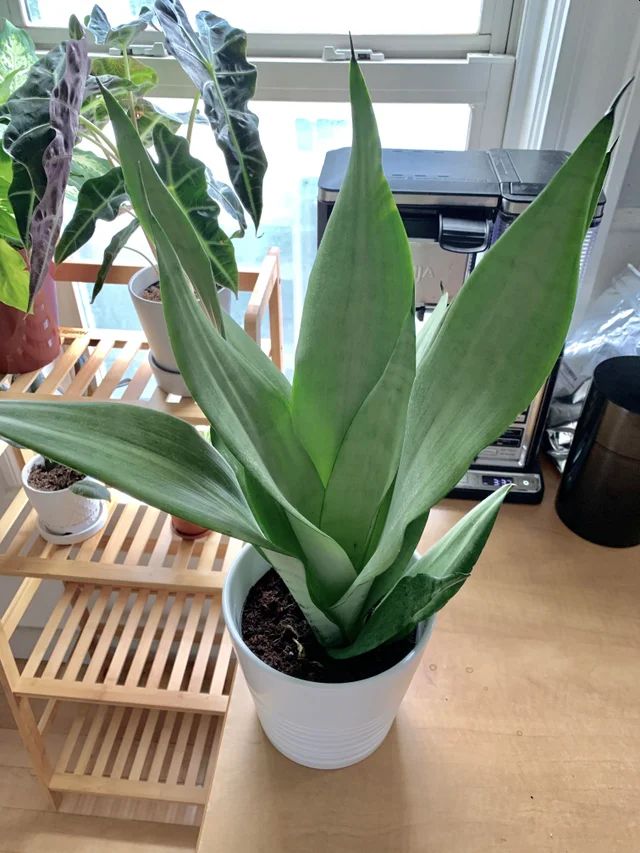
Find the location of `blank and silver ninja coffee machine`. blank and silver ninja coffee machine is located at coordinates (436, 270).